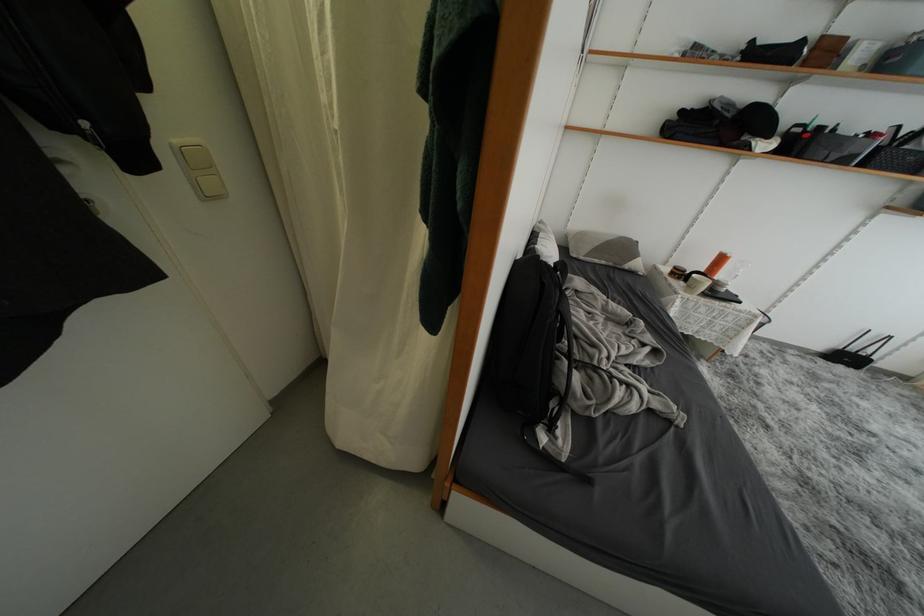
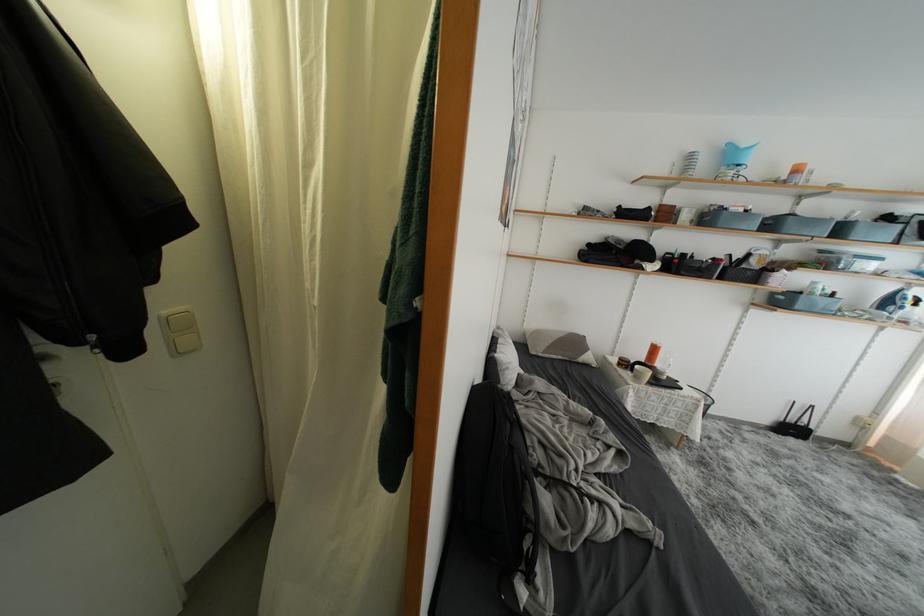
In the second image, find the point that corresponds to (x=883, y=50) in the first image.

(700, 215)